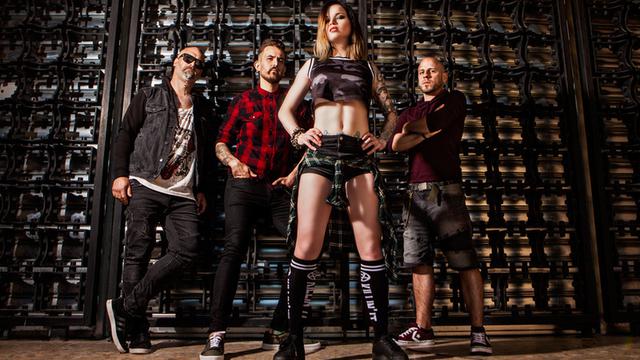
The width and height of the screenshot is (640, 360). Find the location of `floor`. floor is located at coordinates (548, 325).